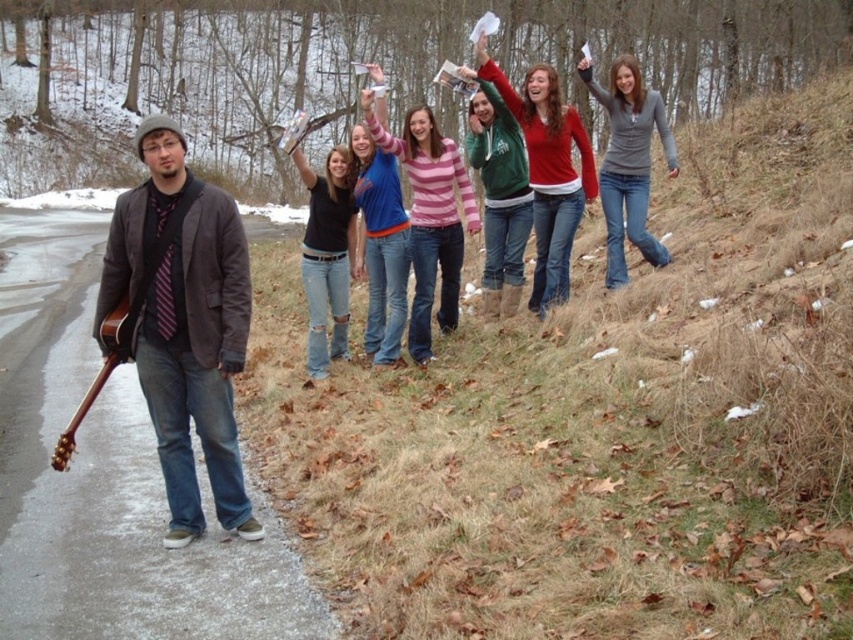
Between gray matte shirt at upper right and black matte shirt at center, which one has less height?

black matte shirt at center is shorter.

Is gray matte shirt at upper right to the right of black matte shirt at center from the viewer's perspective?

Yes, gray matte shirt at upper right is to the right of black matte shirt at center.

At what (x,y) coordinates should I click in order to perform the action: click on gray matte shirt at upper right. Please return your answer as a coordinate pair (x, y). Looking at the image, I should click on (628, 163).

Who is positioned more to the right, gray matte shirt at upper right or matte blue jeans at center?

Positioned to the right is gray matte shirt at upper right.

Is gray matte shirt at upper right to the right of matte blue jeans at center from the viewer's perspective?

Correct, you'll find gray matte shirt at upper right to the right of matte blue jeans at center.

Describe the element at coordinates (628, 163) in the screenshot. This screenshot has width=853, height=640. I see `gray matte shirt at upper right` at that location.

The width and height of the screenshot is (853, 640). Identify the location of gray matte shirt at upper right. (628, 163).

The image size is (853, 640). In order to click on matte black jacket at left in this screenshot , I will do `click(198, 362)`.

Is point (166, 401) closer to camera compared to point (526, 129)?

Yes, it is in front of point (526, 129).

Identify the location of matte black jacket at left. The width and height of the screenshot is (853, 640). (198, 362).